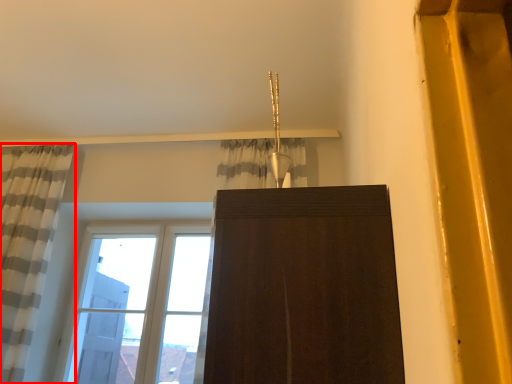
Question: From the image's perspective, what is the correct spatial relationship of curtain (annotated by the red box) in relation to window?

Choices:
 (A) below
 (B) above

Answer: (B)